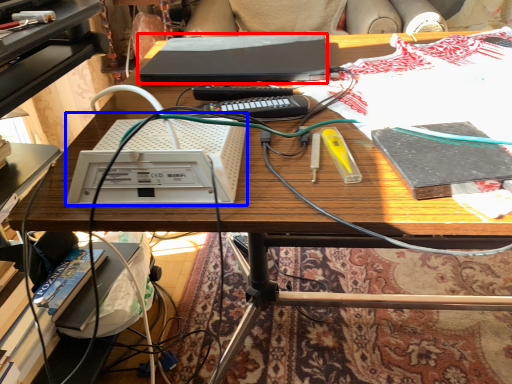
Question: Which object is closer to the camera taking this photo, computer (highlighted by a red box) or equipment (highlighted by a blue box)?

Choices:
 (A) computer
 (B) equipment

Answer: (B)